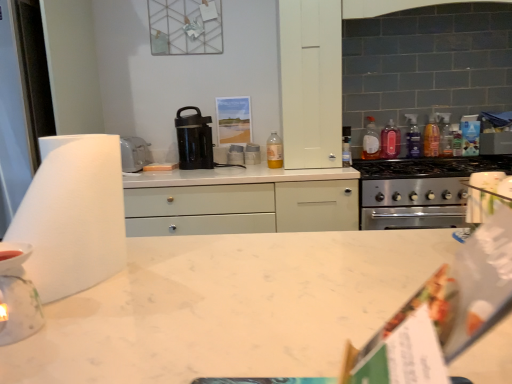
Question: Considering the relative sizes of white glossy stack of plates at center, arranged as the first appliance when viewed from the top, and translucent plastic bottle at upper right, the third bottle positioned from the left, in the image provided, is white glossy stack of plates at center, arranged as the first appliance when viewed from the top, thinner than translucent plastic bottle at upper right, the third bottle positioned from the left,?

Choices:
 (A) no
 (B) yes

Answer: (A)

Question: Is white glossy stack of plates at center, the first appliance from the right, positioned with its back to translucent plastic bottle at upper right, acting as the 3th bottle starting from the right?

Choices:
 (A) yes
 (B) no

Answer: (B)

Question: From the image's perspective, is white glossy stack of plates at center, the first appliance from the right, on translucent plastic bottle at upper right, acting as the 3th bottle starting from the right?

Choices:
 (A) yes
 (B) no

Answer: (B)

Question: Can you confirm if white glossy stack of plates at center, the 3th appliance from the bottom, is positioned to the left of translucent plastic bottle at upper right, acting as the 3th bottle starting from the right?

Choices:
 (A) yes
 (B) no

Answer: (A)

Question: Is white glossy stack of plates at center, which appears as the 3th appliance when viewed from the left, bigger than translucent plastic bottle at upper right, the third bottle positioned from the left?

Choices:
 (A) yes
 (B) no

Answer: (A)

Question: Considering the positions of white matte cabinet at upper center and translucent plastic bottles at upper right, arranged as the 5th bottle when viewed from the left, in the image, is white matte cabinet at upper center wider or thinner than translucent plastic bottles at upper right, arranged as the 5th bottle when viewed from the left,?

Choices:
 (A) wide
 (B) thin

Answer: (A)

Question: From the image's perspective, is white matte cabinet at upper center located above or below translucent plastic bottles at upper right, marked as the first bottle in a right-to-left arrangement?

Choices:
 (A) below
 (B) above

Answer: (B)

Question: Based on their sizes in the image, would you say white matte cabinet at upper center is bigger or smaller than translucent plastic bottles at upper right, marked as the first bottle in a right-to-left arrangement?

Choices:
 (A) big
 (B) small

Answer: (A)

Question: Is white matte cabinet at upper center taller or shorter than translucent plastic bottles at upper right, arranged as the 5th bottle when viewed from the left?

Choices:
 (A) tall
 (B) short

Answer: (A)

Question: Considering the positions of point (371, 137) and point (393, 185), is point (371, 137) closer or farther from the camera than point (393, 185)?

Choices:
 (A) closer
 (B) farther

Answer: (B)

Question: From a real-world perspective, is translucent plastic bottle at upper right, the 2th bottle when ordered from left to right, above or below stainless steel stove at right?

Choices:
 (A) below
 (B) above

Answer: (B)

Question: In the image, is translucent plastic bottle at upper right, the 2th bottle when ordered from left to right, positioned in front of or behind stainless steel stove at right?

Choices:
 (A) front
 (B) behind

Answer: (B)

Question: Is translucent plastic bottle at upper right, the 2th bottle when ordered from left to right, bigger or smaller than stainless steel stove at right?

Choices:
 (A) big
 (B) small

Answer: (B)

Question: Looking at the image, does white matte paper towel at left seem bigger or smaller compared to stainless steel stove at right?

Choices:
 (A) big
 (B) small

Answer: (B)

Question: Would you say white matte paper towel at left is inside or outside stainless steel stove at right?

Choices:
 (A) outside
 (B) inside

Answer: (A)